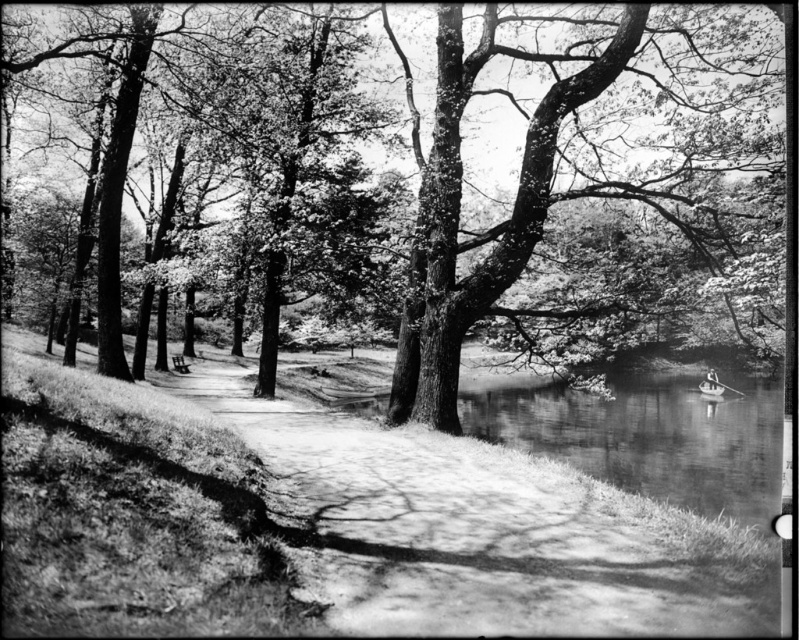
You are standing at the point closer to the camera in the park scene. Which point are you at, point (509,221) or point (682,552)?

You are at point (509,221) because it is closer to the camera than point (682,552).

You are standing at the start of the pathway in the park. You want to walk to the wooden park bench at center, but you also notice the smooth water at lower right. Which object is closer to you as you begin your walk?

The smooth water at lower right is closer to the viewer than the wooden park bench at center, so the smooth water at lower right is closer to you as you begin your walk.